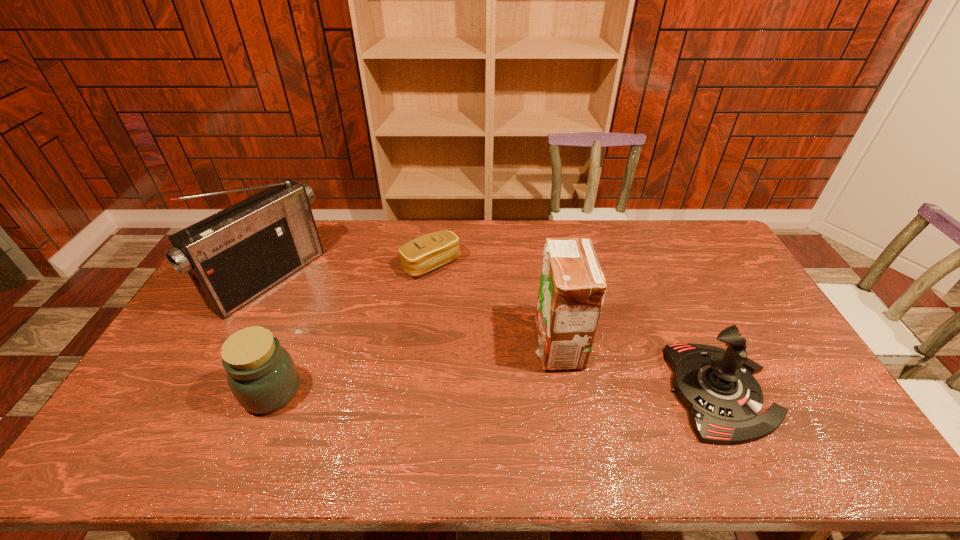
You are a GUI agent. You are given a task and a screenshot of the screen. Output one action in this format:
    pyautogui.click(x=<x>, y=<y>)
    Task: Click on the vacant space that satisfies the following two spatial constraints: 1. on the front side of the fourth tallest object; 2. on the handle side of the rightmost object
    The height and width of the screenshot is (540, 960).
    Given the screenshot: What is the action you would take?
    272,392

This screenshot has width=960, height=540. I want to click on free location that satisfies the following two spatial constraints: 1. on the front side of the clutch bag; 2. on the left side of the fourth object from left to right, so click(x=420, y=346).